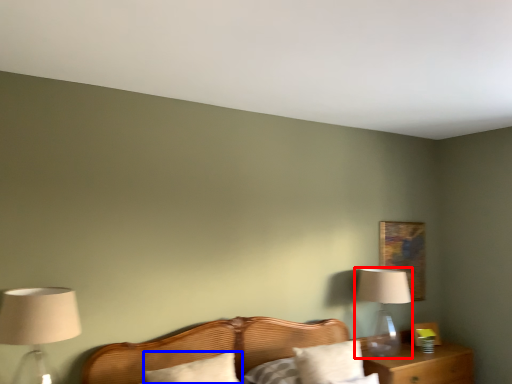
Question: Which point is further to the camera, table lamp (highlighted by a red box) or pillow (highlighted by a blue box)?

Choices:
 (A) table lamp
 (B) pillow

Answer: (A)